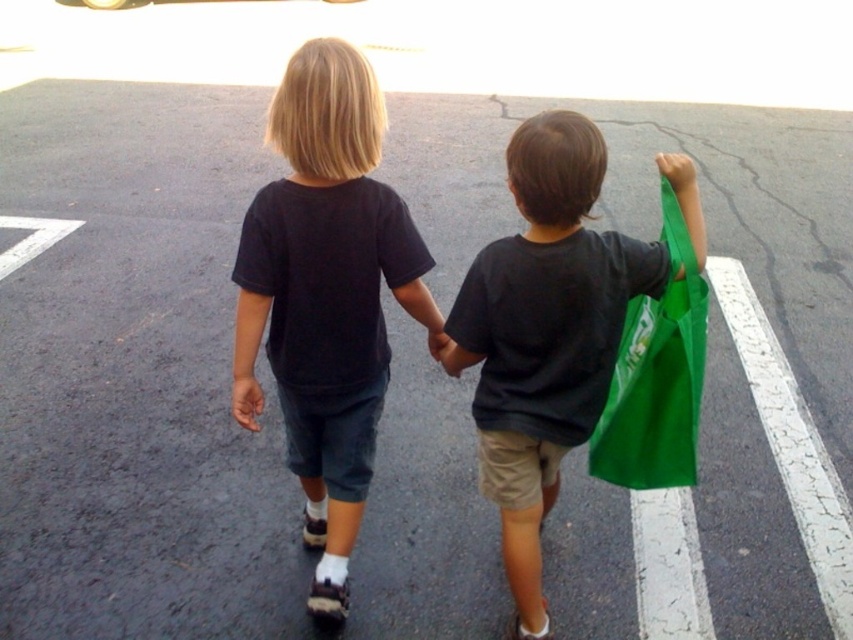
Question: Among these points, which one is nearest to the camera?

Choices:
 (A) (685, 189)
 (B) (250, 388)
 (C) (660, 372)

Answer: (A)

Question: Is matte skin hand at center smaller than green fabric bag at upper right?

Choices:
 (A) yes
 (B) no

Answer: (A)

Question: Can you confirm if black cotton shirt at center is positioned above green fabric bag at right?

Choices:
 (A) yes
 (B) no

Answer: (A)

Question: Which point is closer to the camera?

Choices:
 (A) (347, 531)
 (B) (641, 353)
 (C) (247, 406)
 (D) (572, 326)

Answer: (D)

Question: Is black cotton shirt at center closer to camera compared to green fabric bag at right?

Choices:
 (A) yes
 (B) no

Answer: (A)

Question: Which of these objects is positioned closest to the matte skin hand at center?

Choices:
 (A) green fabric bag at upper right
 (B) black cotton shirt at center
 (C) green fabric bag at right
 (D) green matte bag at right

Answer: (B)